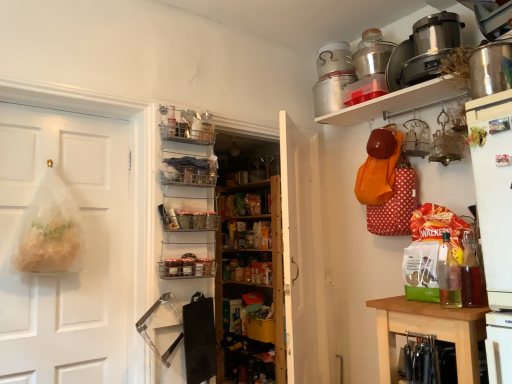
Identify the location of free point above clear plastic bag at left, which ranks as the second door in right-to-left order (from a real-world perspective). (64, 114).